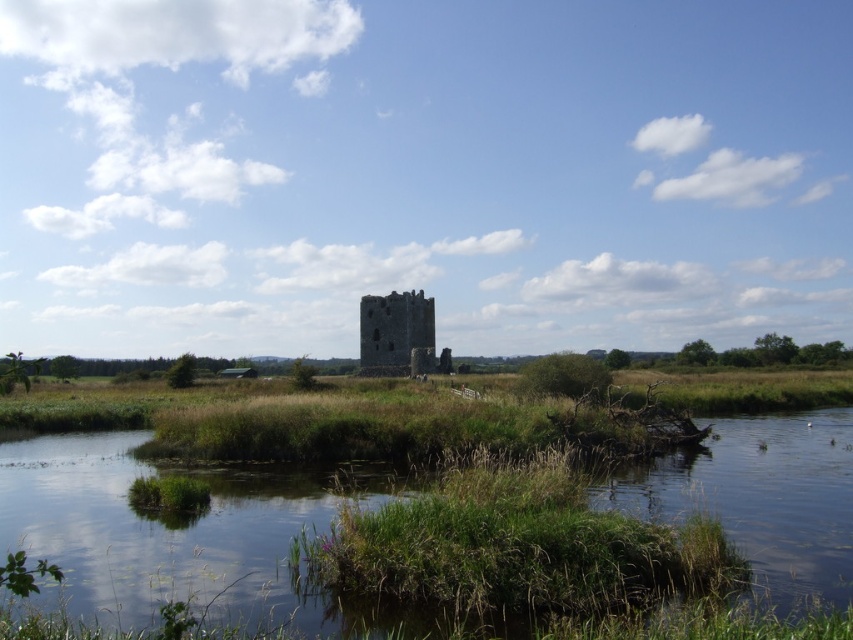
Question: Which point appears closest to the camera in this image?

Choices:
 (A) (68, 593)
 (B) (412, 356)

Answer: (A)

Question: Does green grassy river at lower center have a lesser width compared to rustic stone tower at center?

Choices:
 (A) yes
 (B) no

Answer: (B)

Question: Does green grassy river at lower center appear over rustic stone tower at center?

Choices:
 (A) yes
 (B) no

Answer: (B)

Question: Which point appears farthest from the camera in this image?

Choices:
 (A) (161, 582)
 (B) (384, 365)

Answer: (B)

Question: Is green grassy river at lower center closer to camera compared to rustic stone tower at center?

Choices:
 (A) no
 (B) yes

Answer: (B)

Question: Which object is closer to the camera taking this photo?

Choices:
 (A) green grassy river at lower center
 (B) rustic stone tower at center

Answer: (A)